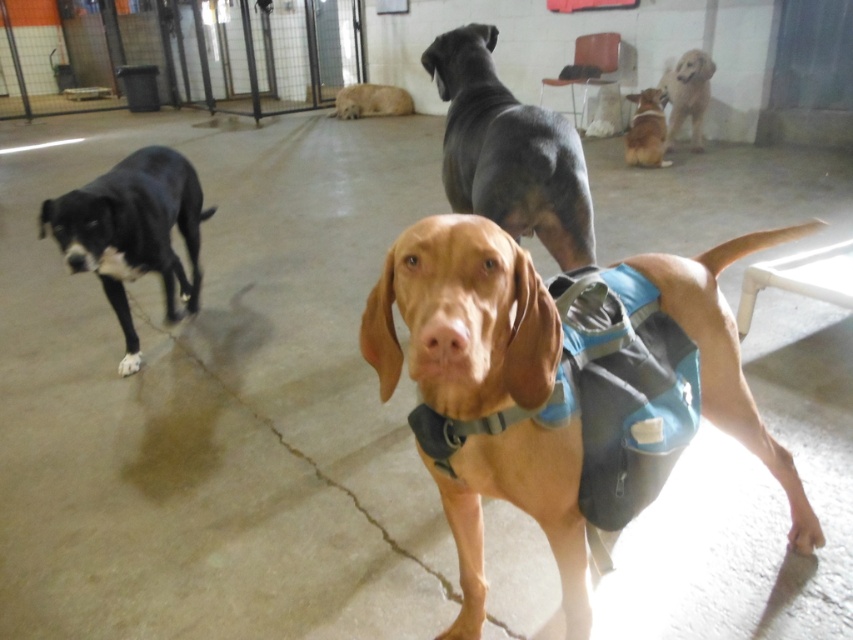
You are a volunteer at the dog shelter and need to determine which dog is taller between the smooth black dog at center and the brown suede dog at upper center. Based on the scene, which one is taller?

The smooth black dog at center is taller than the brown suede dog at upper center.

From the picture: You are a volunteer at the dog shelter and need to separate the smooth black dog at center and the brown suede dog at upper center. Which dog should you approach first if you want to minimize disturbing the other dogs?

You should approach the smooth black dog at center first because it is located below the brown suede dog at upper center, so reaching it would require less movement towards the other dogs.